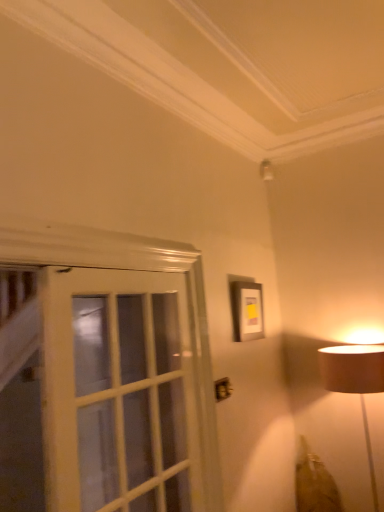
Where is `matte black picture frame at upper center`? matte black picture frame at upper center is located at coordinates (247, 310).

What do you see at coordinates (247, 310) in the screenshot?
I see `matte black picture frame at upper center` at bounding box center [247, 310].

In order to face white glass screen door at left, should I rotate leftwards or rightwards?

It's best to rotate left around 7.034 degrees.

At what (x,y) coordinates should I click in order to perform the action: click on white glass screen door at left. Please return your answer as a coordinate pair (x, y). This screenshot has width=384, height=512. Looking at the image, I should click on (120, 393).

The width and height of the screenshot is (384, 512). What do you see at coordinates (120, 393) in the screenshot? I see `white glass screen door at left` at bounding box center [120, 393].

Locate an element on the screen. matte black picture frame at upper center is located at coordinates (247, 310).

Which object is positioned more to the right, white glass screen door at left or matte black picture frame at upper center?

matte black picture frame at upper center.

Which object is closer to the camera, white glass screen door at left or matte black picture frame at upper center?

white glass screen door at left is closer to the camera.

Does point (52, 410) lie in front of point (247, 312)?

Yes, it is in front of point (247, 312).

From the image's perspective, is white glass screen door at left over matte black picture frame at upper center?

Incorrect, from the image's perspective, white glass screen door at left is lower than matte black picture frame at upper center.

From a real-world perspective, is white glass screen door at left physically below matte black picture frame at upper center?

Yes, from a real-world perspective, white glass screen door at left is under matte black picture frame at upper center.

Can you confirm if white glass screen door at left is thinner than matte black picture frame at upper center?

Answer: In fact, white glass screen door at left might be wider than matte black picture frame at upper center.

Is white glass screen door at left taller than matte black picture frame at upper center?

Correct, white glass screen door at left is much taller as matte black picture frame at upper center.

Is white glass screen door at left smaller than matte black picture frame at upper center?

Actually, white glass screen door at left might be larger than matte black picture frame at upper center.

Is matte black picture frame at upper center completely or partially inside white glass screen door at left?

No, matte black picture frame at upper center is not surrounded by white glass screen door at left.

Is white glass screen door at left beside matte black picture frame at upper center?

white glass screen door at left is not next to matte black picture frame at upper center, and they're not touching.

Is white glass screen door at left oriented away from matte black picture frame at upper center?

white glass screen door at left is not turned away from matte black picture frame at upper center.

How different are the orientations of white glass screen door at left and matte black picture frame at upper center in degrees?

They differ by 4.32 degrees in their facing directions.

At what (x,y) coordinates should I click in order to perform the action: click on picture frame behind the white glass screen door at left. Please return your answer as a coordinate pair (x, y). The width and height of the screenshot is (384, 512). Looking at the image, I should click on (247, 310).

Visually, is matte black picture frame at upper center positioned to the left or to the right of white glass screen door at left?

matte black picture frame at upper center is positioned on white glass screen door at left's right side.

Does matte black picture frame at upper center come in front of white glass screen door at left?

No, matte black picture frame at upper center is further to the viewer.

Which is closer, [261,296] or [167,295]?

Point [261,296].

Consider the image. From the image's perspective, which is below, matte black picture frame at upper center or white glass screen door at left?

white glass screen door at left appears lower in the image.

From a real-world perspective, is matte black picture frame at upper center below white glass screen door at left?

No, from a real-world perspective, matte black picture frame at upper center is not under white glass screen door at left.

In terms of width, does matte black picture frame at upper center look wider or thinner when compared to white glass screen door at left?

Clearly, matte black picture frame at upper center has less width compared to white glass screen door at left.

Does matte black picture frame at upper center have a greater height compared to white glass screen door at left?

No.

Considering the sizes of matte black picture frame at upper center and white glass screen door at left in the image, is matte black picture frame at upper center bigger or smaller than white glass screen door at left?

matte black picture frame at upper center is smaller than white glass screen door at left.

Would you say matte black picture frame at upper center is outside white glass screen door at left?

Yes.

Is matte black picture frame at upper center not near white glass screen door at left?

Absolutely, matte black picture frame at upper center is distant from white glass screen door at left.

Is matte black picture frame at upper center aimed at white glass screen door at left?

No, matte black picture frame at upper center is not oriented towards white glass screen door at left.

What's the angular difference between matte black picture frame at upper center and white glass screen door at left's facing directions?

The angle between the facing direction of matte black picture frame at upper center and the facing direction of white glass screen door at left is 4.32 degrees.

Locate an element on the screen. The width and height of the screenshot is (384, 512). screen door below the matte black picture frame at upper center (from a real-world perspective) is located at coordinates (120, 393).

This screenshot has width=384, height=512. I want to click on picture frame that appears behind the white glass screen door at left, so click(247, 310).

At what (x,y) coordinates should I click in order to perform the action: click on screen door below the matte black picture frame at upper center (from a real-world perspective). Please return your answer as a coordinate pair (x, y). This screenshot has width=384, height=512. Looking at the image, I should click on (120, 393).